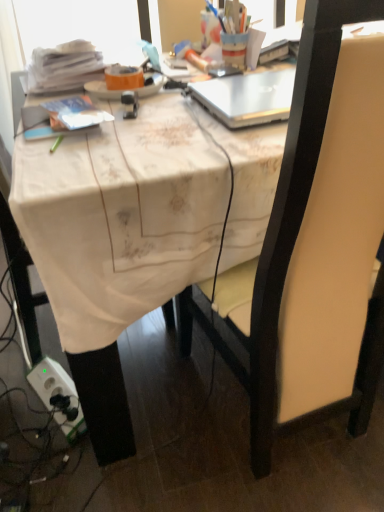
I want to click on blank space situated above silver metallic laptop at upper center (from a real-world perspective), so click(x=258, y=84).